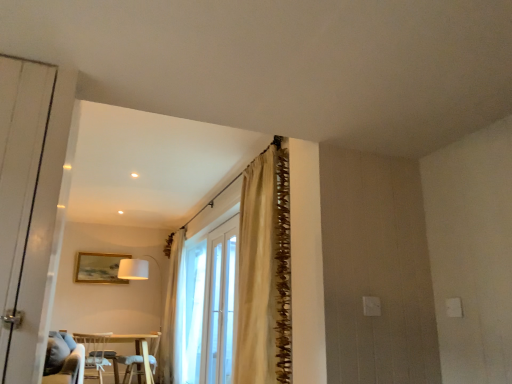
The height and width of the screenshot is (384, 512). What are the coordinates of `velvet blue armchair at lower center` in the screenshot? It's located at (132, 366).

Where is `beige textured curtain at upper center, which ranks as the 2th curtain in left-to-right order`? The width and height of the screenshot is (512, 384). beige textured curtain at upper center, which ranks as the 2th curtain in left-to-right order is located at coordinates (257, 273).

What do you see at coordinates (214, 313) in the screenshot? Image resolution: width=512 pixels, height=384 pixels. I see `clear glass door at center` at bounding box center [214, 313].

Image resolution: width=512 pixels, height=384 pixels. What are the coordinates of `white sheer curtain at center, the 2th curtain when ordered from right to left` in the screenshot? It's located at (173, 314).

Find the location of a particular element. This screenshot has width=512, height=384. velvet blue armchair at lower center is located at coordinates (132, 366).

This screenshot has height=384, width=512. In order to click on chair on the left of clear glass door at center in this screenshot , I will do `click(95, 353)`.

Consider the image. Is clear glass door at center at the right side of white fabric chair at lower left?

Yes.

From a real-world perspective, is clear glass door at center located beneath white fabric chair at lower left?

No, from a real-world perspective, clear glass door at center is not under white fabric chair at lower left.

Is white fabric chair at lower left surrounded by clear glass door at center?

No.

Is velvet blue armchair at lower center aimed at gold metallic picture frame at upper center?

No, velvet blue armchair at lower center does not turn towards gold metallic picture frame at upper center.

From a real-world perspective, is velvet blue armchair at lower center physically located above or below gold metallic picture frame at upper center?

In terms of real-world spatial position, velvet blue armchair at lower center is below gold metallic picture frame at upper center.

Is velvet blue armchair at lower center inside or outside of gold metallic picture frame at upper center?

velvet blue armchair at lower center cannot be found inside gold metallic picture frame at upper center.

Does point (138, 374) come closer to viewer compared to point (120, 257)?

That is True.

How far apart are white fabric chair at lower left and white glass bay window at center?

6.47 feet.

Identify the location of chair on the left of the white glass bay window at center. The image size is (512, 384). (95, 353).

Is white fabric chair at lower left aimed at white glass bay window at center?

No, white fabric chair at lower left is not aimed at white glass bay window at center.

Which of these two, white fabric chair at lower left or white glass bay window at center, is smaller?

white fabric chair at lower left is smaller.

Where is `curtain below the white wooden door at left (from a real-world perspective)`? curtain below the white wooden door at left (from a real-world perspective) is located at coordinates (173, 314).

Is white wooden door at left further to camera compared to white sheer curtain at center, which is the first curtain from left to right?

No, white wooden door at left is closer to the viewer.

Which of these two, white wooden door at left or white sheer curtain at center, the 2th curtain from the front, is smaller?

Smaller between the two is white wooden door at left.

Is white wooden door at left outside of white sheer curtain at center, the 2th curtain from the front?

Absolutely, white wooden door at left is external to white sheer curtain at center, the 2th curtain from the front.

Is velvet blue armchair at lower center aimed at white glass bay window at center?

No, velvet blue armchair at lower center is not turned towards white glass bay window at center.

Is velvet blue armchair at lower center far from white glass bay window at center?

Yes.

Is velvet blue armchair at lower center located outside white glass bay window at center?

That's correct, velvet blue armchair at lower center is outside of white glass bay window at center.

Measure the distance from velvet blue armchair at lower center to white glass bay window at center.

6.07 feet.

Is white wooden door at left inside or outside of white glass bay window at center?

white wooden door at left is spatially situated outside white glass bay window at center.

From the image's perspective, is white wooden door at left located beneath white glass bay window at center?

No, from the image's perspective, white wooden door at left is not below white glass bay window at center.

How far apart are white wooden door at left and white glass bay window at center?

white wooden door at left and white glass bay window at center are 12.63 feet apart from each other.

Is white wooden door at left far away from white glass bay window at center?

Yes.

Can you tell me how much white sheer curtain at center, acting as the first curtain starting from the back, and beige textured curtain at upper center, acting as the first curtain starting from the right, differ in facing direction?

0.713 degrees separate the facing orientations of white sheer curtain at center, acting as the first curtain starting from the back, and beige textured curtain at upper center, acting as the first curtain starting from the right.

The image size is (512, 384). Find the location of `curtain behind the beige textured curtain at upper center, the first curtain from the front`. curtain behind the beige textured curtain at upper center, the first curtain from the front is located at coordinates (173, 314).

Considering the relative positions of white sheer curtain at center, the 2th curtain from the front, and beige textured curtain at upper center, the first curtain from the front, in the image provided, is white sheer curtain at center, the 2th curtain from the front, to the right of beige textured curtain at upper center, the first curtain from the front, from the viewer's perspective?

Incorrect, white sheer curtain at center, the 2th curtain from the front, is not on the right side of beige textured curtain at upper center, the first curtain from the front.

Which is behind, white sheer curtain at center, the 2th curtain when ordered from right to left, or beige textured curtain at upper center, which ranks as the 2th curtain in left-to-right order?

white sheer curtain at center, the 2th curtain when ordered from right to left, is behind.

There is a white fabric chair at lower left. Where is `screen door above it (from a real-world perspective)`? screen door above it (from a real-world perspective) is located at coordinates (214, 313).

Find the location of a particular element. This screenshot has height=384, width=512. armchair in front of the gold metallic picture frame at upper center is located at coordinates (132, 366).

Which object lies further to the anchor point white wooden door at left, white glass bay window at center or white fabric chair at lower left?

white fabric chair at lower left is positioned further to the anchor white wooden door at left.

From the image, which object appears to be farther from velvet blue armchair at lower center, white sheer curtain at center, acting as the first curtain starting from the back, or white wooden door at left?

white wooden door at left is further to velvet blue armchair at lower center.

Considering their positions, is white wooden door at left positioned further to white glass bay window at center than white sheer curtain at center, which is the first curtain from left to right?

Based on the image, white wooden door at left appears to be further to white glass bay window at center.

Looking at the image, which one is located closer to white sheer curtain at center, the 2th curtain when ordered from right to left, velvet blue armchair at lower center or white wooden door at left?

velvet blue armchair at lower center.

When comparing their distances from clear glass door at center, does white glass bay window at center or white fabric chair at lower left seem closer?

white glass bay window at center lies closer to clear glass door at center than the other object.

Based on their spatial positions, is gold metallic picture frame at upper center or white sheer curtain at center, the 2th curtain when ordered from right to left, further from clear glass door at center?

gold metallic picture frame at upper center is positioned further to the anchor clear glass door at center.

Consider the image. Based on their spatial positions, is white sheer curtain at center, the 2th curtain when ordered from right to left, or gold metallic picture frame at upper center closer to white fabric chair at lower left?

The object closer to white fabric chair at lower left is gold metallic picture frame at upper center.

Looking at the image, which one is located closer to white sheer curtain at center, the 2th curtain from the front, white wooden door at left or white glass bay window at center?

The object closer to white sheer curtain at center, the 2th curtain from the front, is white glass bay window at center.

Where is `chair located between white wooden door at left and velvet blue armchair at lower center in the depth direction`? This screenshot has width=512, height=384. chair located between white wooden door at left and velvet blue armchair at lower center in the depth direction is located at coordinates (95, 353).

The image size is (512, 384). Identify the location of chair between white wooden door at left and white glass bay window at center in the front-back direction. (95, 353).

At what (x,y) coordinates should I click in order to perform the action: click on curtain between white wooden door at left and white sheer curtain at center, the 2th curtain when ordered from right to left, from front to back. Please return your answer as a coordinate pair (x, y). Looking at the image, I should click on (257, 273).

Where is `armchair located between white fabric chair at lower left and clear glass door at center in the left-right direction`? The width and height of the screenshot is (512, 384). armchair located between white fabric chair at lower left and clear glass door at center in the left-right direction is located at coordinates (132, 366).